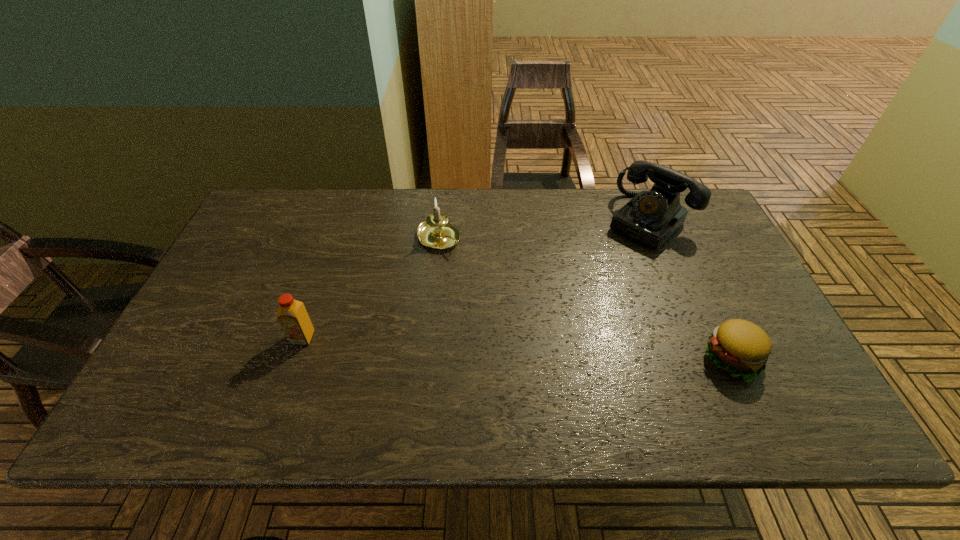
Identify the location of vacant space situated 0.220m on the handle side of the second object from left to right. The width and height of the screenshot is (960, 540). (501, 294).

Locate an element on the screen. The height and width of the screenshot is (540, 960). free location located 0.280m on the handle side of the second object from left to right is located at coordinates (517, 307).

You are a GUI agent. You are given a task and a screenshot of the screen. Output one action in this format:
    pyautogui.click(x=<x>, y=<y>)
    Task: Click on the telephone that is at the far edge
    
    Given the screenshot: What is the action you would take?
    pyautogui.click(x=650, y=218)

You are a GUI agent. You are given a task and a screenshot of the screen. Output one action in this format:
    pyautogui.click(x=<x>, y=<y>)
    Task: Click on the candle holder that is positioned at the far edge
    Image resolution: width=960 pixels, height=540 pixels.
    Given the screenshot: What is the action you would take?
    pyautogui.click(x=436, y=232)

This screenshot has height=540, width=960. I want to click on object located in the near edge section of the desktop, so click(x=740, y=347).

Locate an element on the screen. This screenshot has width=960, height=540. hamburger at the right edge is located at coordinates (740, 347).

In order to click on telephone present at the right edge in this screenshot , I will do `click(650, 218)`.

At what (x,y) coordinates should I click in order to perform the action: click on object present at the far right corner. Please return your answer as a coordinate pair (x, y). Image resolution: width=960 pixels, height=540 pixels. Looking at the image, I should click on (650, 218).

In order to click on object that is at the near right corner in this screenshot , I will do `click(740, 347)`.

Find the location of a particular element. The height and width of the screenshot is (540, 960). vacant region at the far edge is located at coordinates (607, 225).